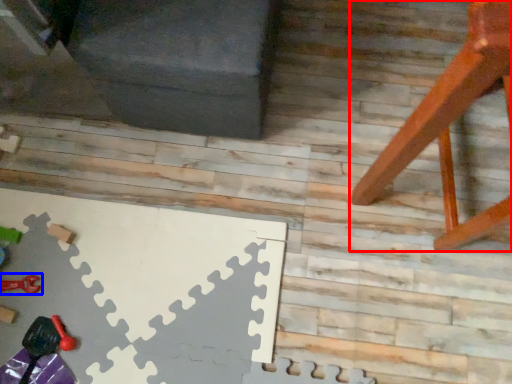
Question: Which of the following is the closest to the observer, furniture (highlighted by a red box) or toy (highlighted by a blue box)?

Choices:
 (A) furniture
 (B) toy

Answer: (A)